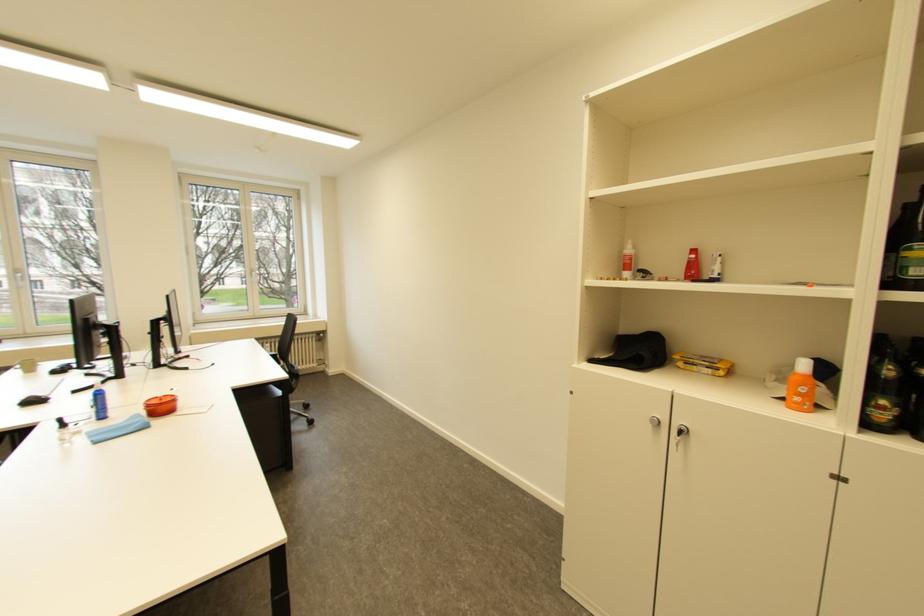
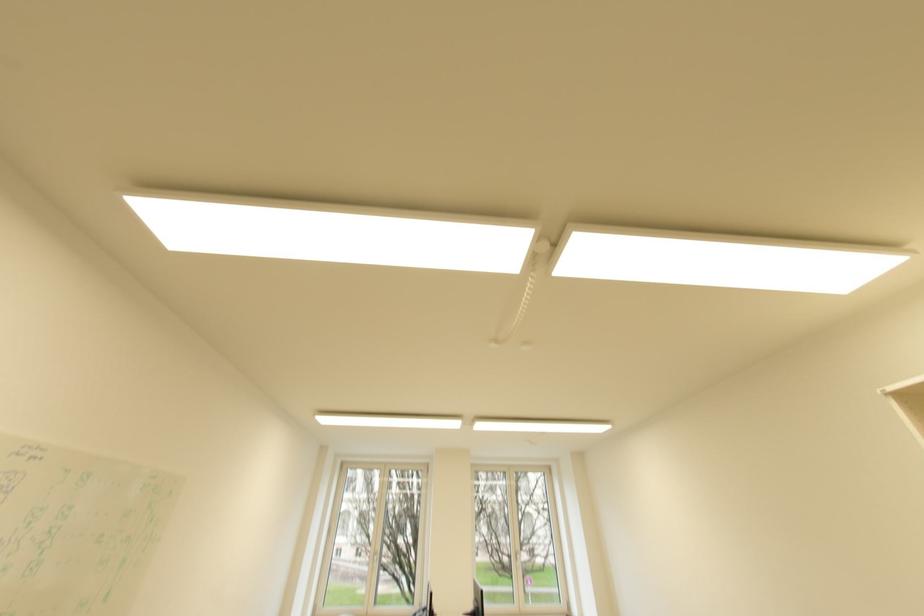
Based on the photo, the first image is from the beginning of the video and the second image is from the end. How did the camera likely rotate when shooting the video?

The rotation direction of the camera is left-up.